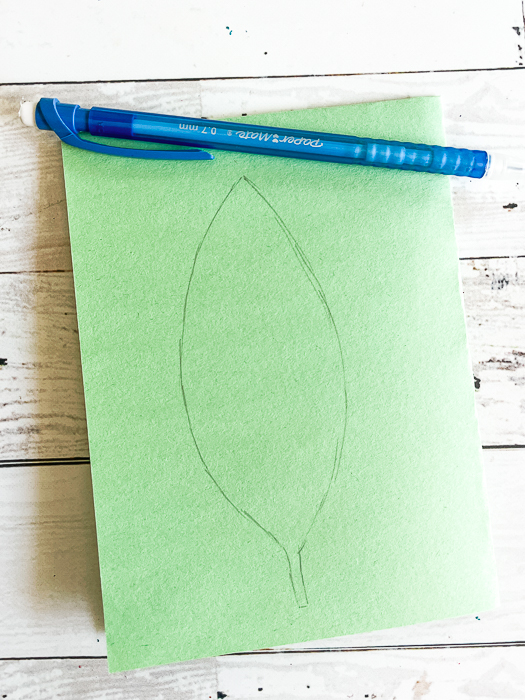
The image size is (525, 700). Identify the location of crease in table. (59, 462).